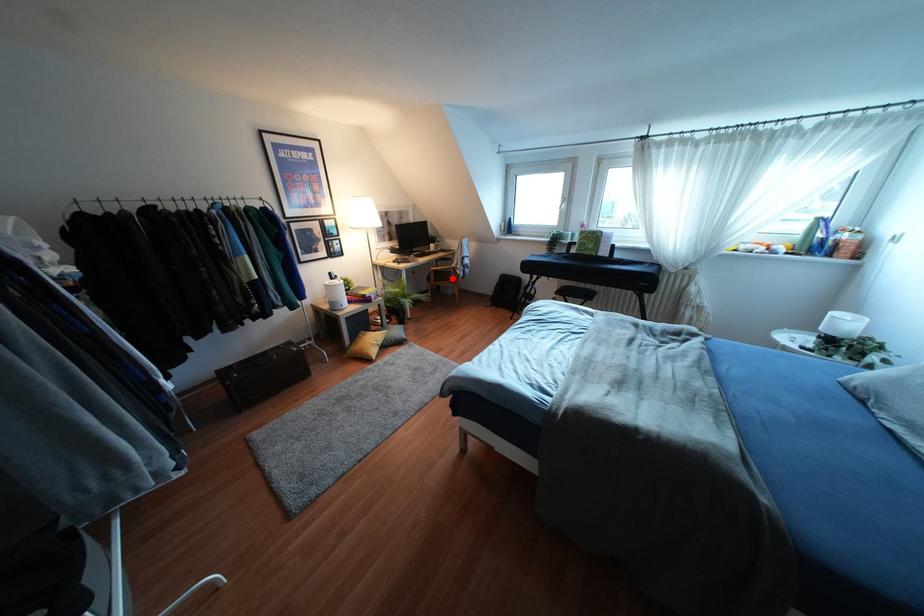
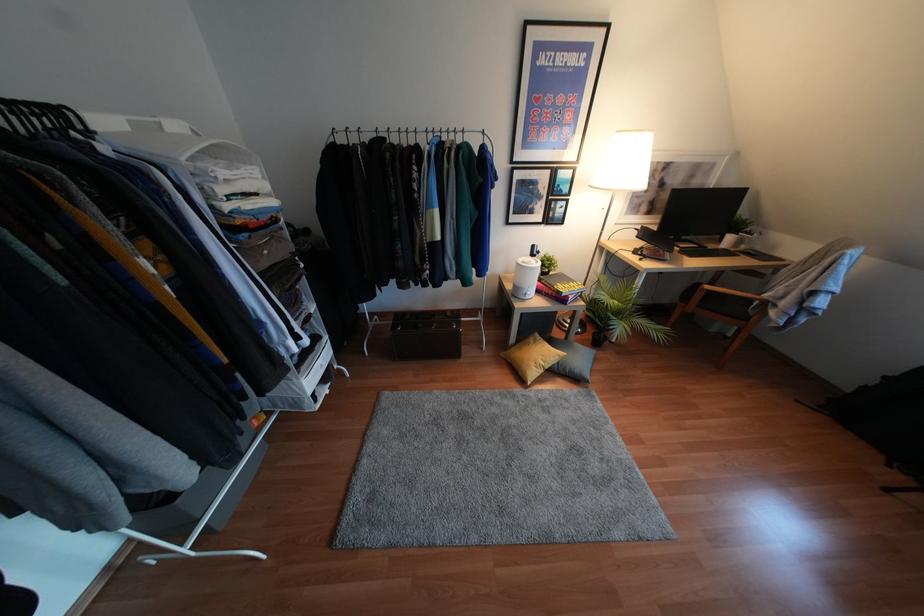
Question: I am providing you with two images of the same scene from different viewpoints. A red point is marked on the first image. Is the red point's position out of view in image 2?

Choices:
 (A) Yes
 (B) No

Answer: (B)